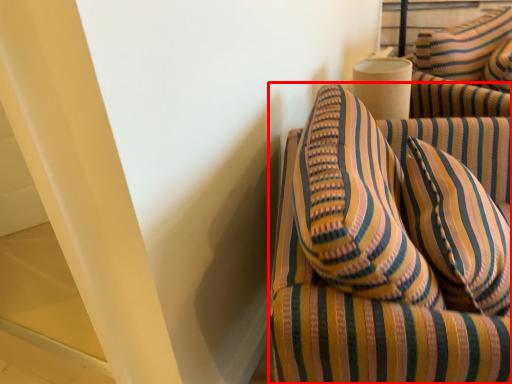
Question: From the image's perspective, where is furniture (annotated by the red box) located in relation to pillow in the image?

Choices:
 (A) below
 (B) above

Answer: (A)